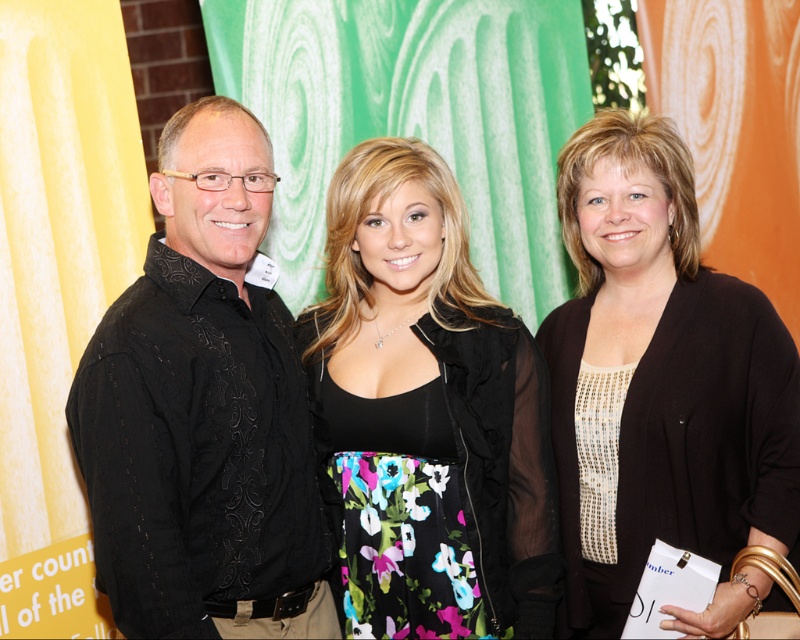
Question: Which object appears farthest from the camera in this image?

Choices:
 (A) sequined beige blouse at center
 (B) black satin dress at center
 (C) black embroidered shirt at left

Answer: (B)

Question: Is black embroidered shirt at left below sequined beige blouse at center?

Choices:
 (A) yes
 (B) no

Answer: (A)

Question: Can you confirm if black embroidered shirt at left is wider than black satin dress at center?

Choices:
 (A) no
 (B) yes

Answer: (A)

Question: Does black embroidered shirt at left lie in front of black satin dress at center?

Choices:
 (A) yes
 (B) no

Answer: (A)

Question: Which object appears closest to the camera in this image?

Choices:
 (A) black embroidered shirt at left
 (B) black satin dress at center

Answer: (A)

Question: Estimate the real-world distances between objects in this image. Which object is closer to the sequined beige blouse at center?

Choices:
 (A) black embroidered shirt at left
 (B) black satin dress at center

Answer: (B)